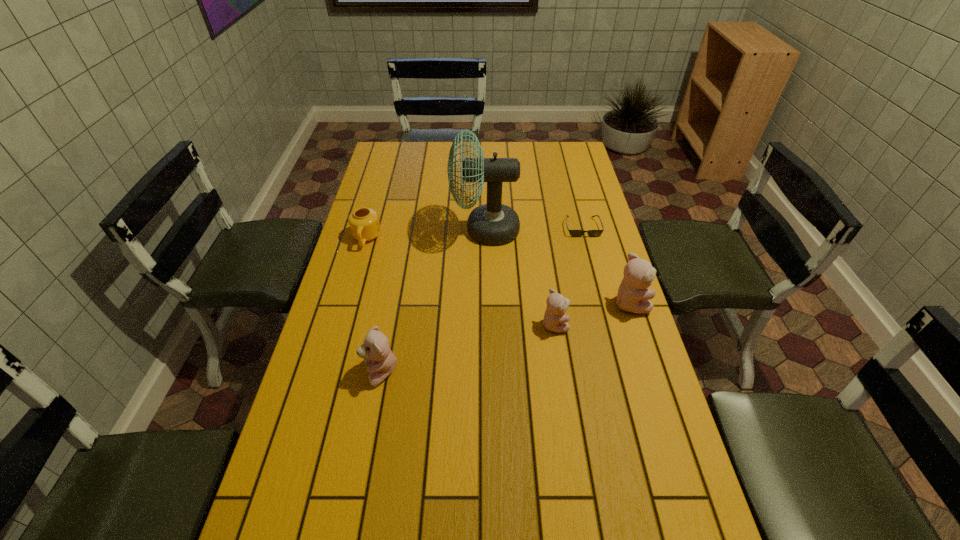
Locate an element on the screen. The width and height of the screenshot is (960, 540). empty space that is in between the fourth object from right to left and the third tallest object is located at coordinates (433, 301).

Image resolution: width=960 pixels, height=540 pixels. I want to click on empty space that is in between the second shortest object and the fourth object from left to right, so click(x=460, y=281).

Image resolution: width=960 pixels, height=540 pixels. I want to click on free space that is in between the second object from left to right and the shortest teddy bear, so click(x=468, y=348).

This screenshot has height=540, width=960. In order to click on vacant region between the nearest teddy bear and the sunglasses in this screenshot , I will do `click(481, 300)`.

Locate an element on the screen. vacant area that lies between the leftmost teddy bear and the shortest object is located at coordinates (481, 300).

Locate an element on the screen. vacant space that is in between the shortest object and the rightmost teddy bear is located at coordinates [606, 265].

Identify the location of free space between the third object from right to left and the sunglasses. This screenshot has width=960, height=540. (568, 275).

Where is `object that is the second nearest to the second shortest object`? The width and height of the screenshot is (960, 540). object that is the second nearest to the second shortest object is located at coordinates (375, 350).

Locate which object is the closest to the fan. Please provide its 2D coordinates. Your answer should be formatted as a tuple, i.e. [(x, y)], where the tuple contains the x and y coordinates of a point satisfying the conditions above.

[(575, 233)]

The height and width of the screenshot is (540, 960). Find the location of `the closest teddy bear relative to the third object from right to left`. the closest teddy bear relative to the third object from right to left is located at coordinates (633, 297).